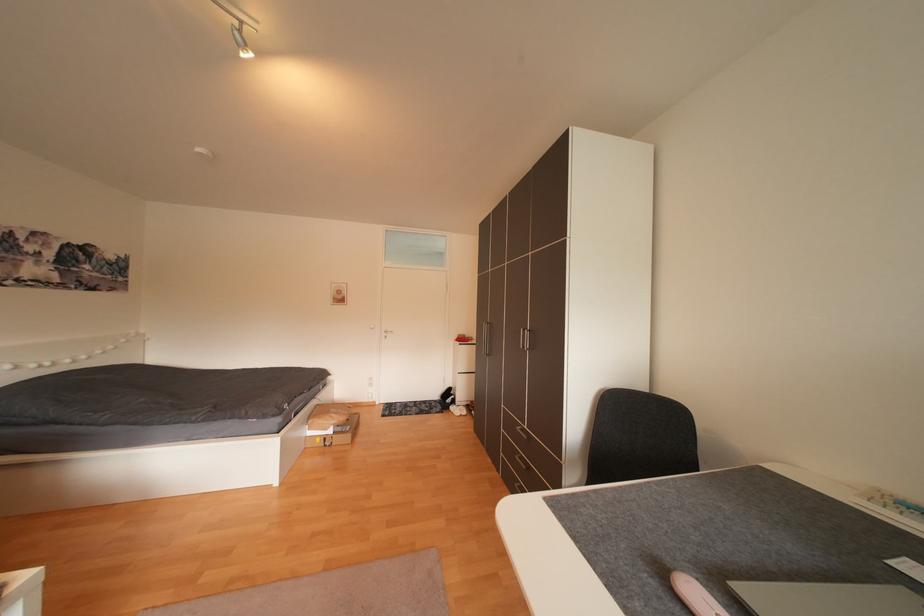
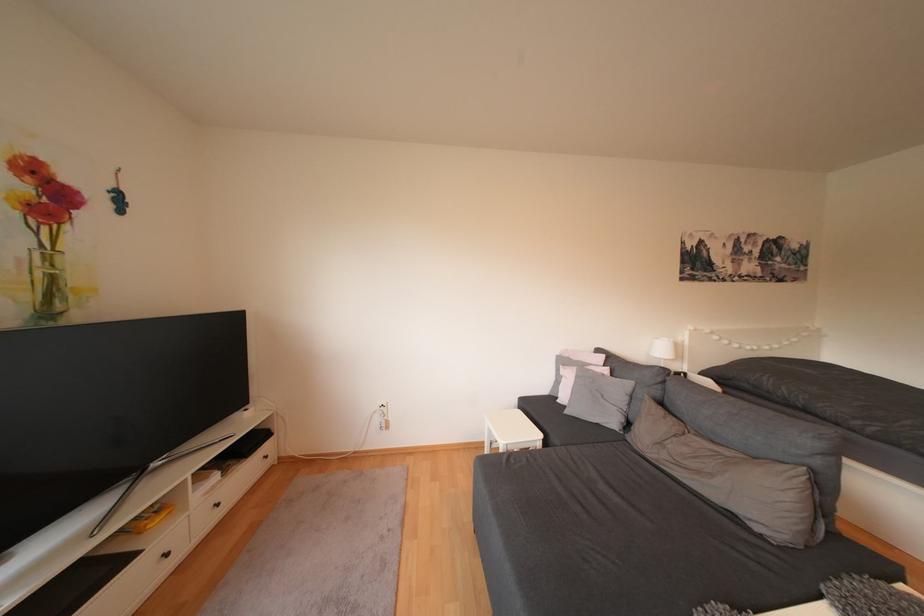
Question: The images are taken continuously from a first-person perspective. In which direction is your viewpoint rotating?

Choices:
 (A) Left
 (B) Right
 (C) Up
 (D) Down

Answer: (A)